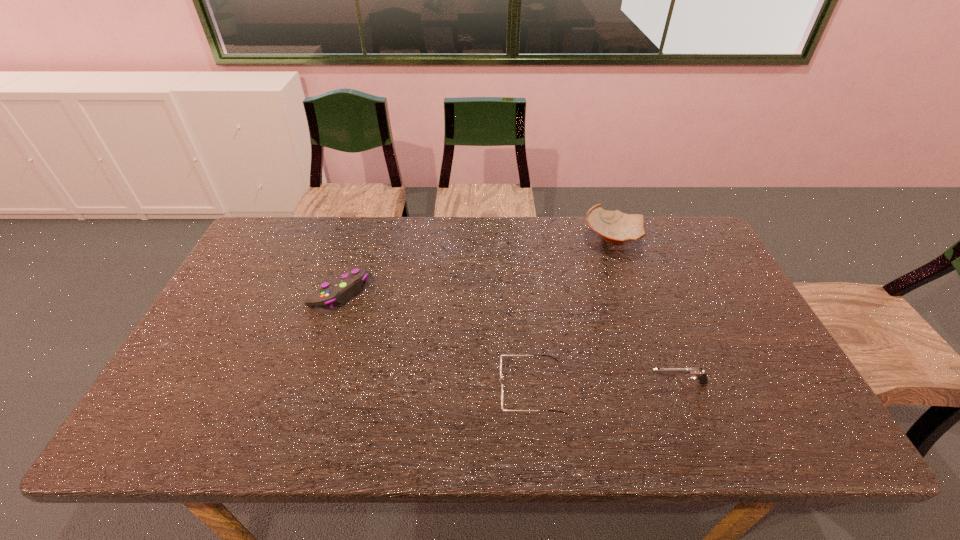
You are a GUI agent. You are given a task and a screenshot of the screen. Output one action in this format:
    pyautogui.click(x=<x>, y=<y>)
    Task: Click on the vacant region located on the front-facing side of the pistol
    This screenshot has width=960, height=540.
    Given the screenshot: What is the action you would take?
    pyautogui.click(x=526, y=383)

This screenshot has width=960, height=540. Identify the location of free region located 0.090m on the front-facing side of the spectacles. (461, 389).

This screenshot has height=540, width=960. Find the location of `vacant position located on the front-facing side of the spectacles`. vacant position located on the front-facing side of the spectacles is located at coordinates (360, 389).

I want to click on vacant area situated 0.090m on the front-facing side of the spectacles, so click(x=461, y=389).

Find the location of `object present at the far edge`. object present at the far edge is located at coordinates pyautogui.click(x=615, y=227).

At what (x,y) coordinates should I click in order to perform the action: click on object situated at the near edge. Please return your answer as a coordinate pair (x, y). Image resolution: width=960 pixels, height=540 pixels. Looking at the image, I should click on (501, 356).

In the image, there is a desktop. Where is `free space at the far edge`? The height and width of the screenshot is (540, 960). free space at the far edge is located at coordinates (492, 223).

Where is `vacant space at the near edge of the desktop`? vacant space at the near edge of the desktop is located at coordinates click(701, 434).

I want to click on free spot at the left edge of the desktop, so point(234,289).

Find the location of a particular element. The image size is (960, 540). free location at the right edge is located at coordinates (712, 321).